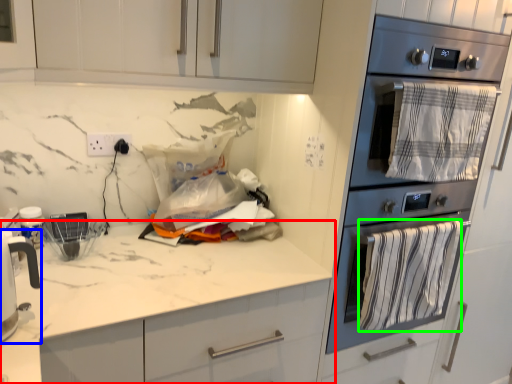
Question: Estimate the real-world distances between objects in this image. Which object is closer to countertop (highlighted by a red box), home appliance (highlighted by a blue box) or blanket (highlighted by a green box)?

Choices:
 (A) home appliance
 (B) blanket

Answer: (A)